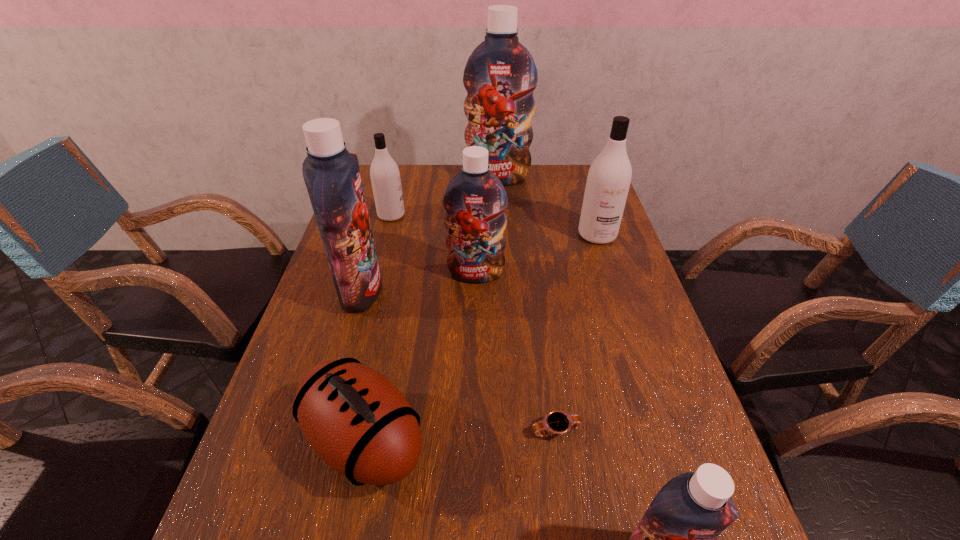
The height and width of the screenshot is (540, 960). Identify the location of the biggest blue shampoo. (500, 75).

Find the location of a particular element. This screenshot has width=960, height=540. the tallest shampoo is located at coordinates click(x=500, y=75).

Identify the location of the seventh shortest object. The image size is (960, 540). (332, 175).

The image size is (960, 540). I want to click on the leftmost blue shampoo, so click(x=332, y=175).

Locate an element on the screen. Image resolution: width=960 pixels, height=540 pixels. the bigger white shampoo is located at coordinates (609, 177).

Where is `the sixth nearest object`? The image size is (960, 540). the sixth nearest object is located at coordinates (609, 177).

You are a GUI agent. You are given a task and a screenshot of the screen. Output one action in this format:
    pyautogui.click(x=<x>, y=<y>)
    Task: Click on the second smallest blue shampoo
    This screenshot has width=960, height=540.
    Given the screenshot: What is the action you would take?
    pyautogui.click(x=475, y=199)

Identify the location of the fifth nearest shampoo. (385, 176).

Locate an element on the screen. the left white shampoo is located at coordinates (385, 176).

Find the location of a particular element. The image size is (960, 540). football (American) is located at coordinates (356, 420).